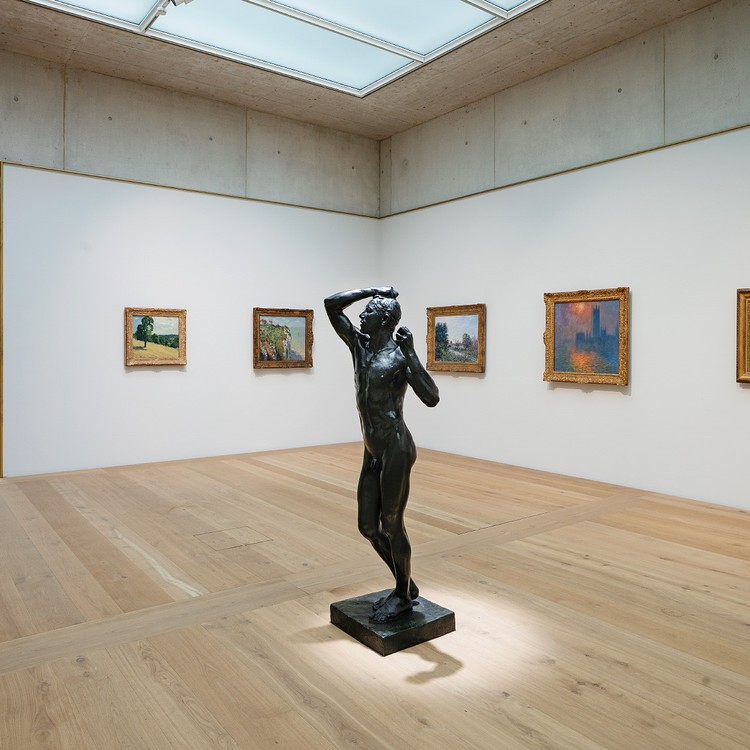
Locate an element on the screen. concrete wall is located at coordinates (166, 129), (507, 145).